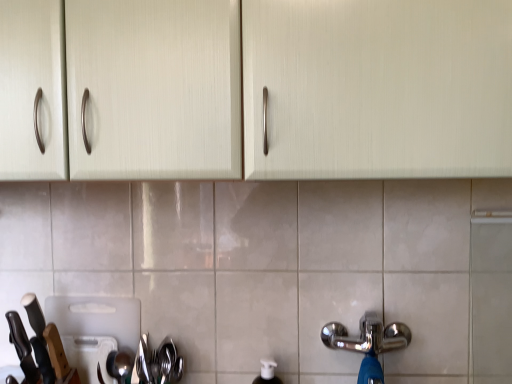
Image resolution: width=512 pixels, height=384 pixels. I want to click on shiny metallic spoon at lower left, so click(148, 363).

Measure the distance between point (136, 360) and camera.

Point (136, 360) is 1.02 meters from camera.

The image size is (512, 384). Identify the location of satin silver spoon at lower left, positioned as the second appliance in back-to-front order. (91, 356).

What do you see at coordinates (257, 89) in the screenshot? I see `matte cream cabinet at upper center` at bounding box center [257, 89].

Identify the location of shiny metallic spoon at lower left. [x=148, y=363].

In terms of width, does black leather knife at lower left, acting as the second knife starting from the right, look wider or thinner when compared to white plastic cutting board at lower left, acting as the first appliance starting from the back?

In the image, black leather knife at lower left, acting as the second knife starting from the right, appears to be wider than white plastic cutting board at lower left, acting as the first appliance starting from the back.

Is white plastic cutting board at lower left, the second appliance when ordered from front to back, surrounded by black leather knife at lower left, acting as the second knife starting from the right?

No.

Considering the sizes of objects black leather knife at lower left, arranged as the first knife when viewed from the left, and white plastic cutting board at lower left, the second appliance when ordered from front to back, in the image provided, who is taller, black leather knife at lower left, arranged as the first knife when viewed from the left, or white plastic cutting board at lower left, the second appliance when ordered from front to back,?

Standing taller between the two is white plastic cutting board at lower left, the second appliance when ordered from front to back.

From a real-world perspective, which object stands above the other?

shiny metallic spoon at lower left, from a real-world perspective.

Is shiny metallic spoon at lower left far from white plastic cutting board at lower left, acting as the first appliance starting from the back?

shiny metallic spoon at lower left is near white plastic cutting board at lower left, acting as the first appliance starting from the back, not far away.

Would you say shiny metallic spoon at lower left contains white plastic cutting board at lower left, acting as the first appliance starting from the back?

No, white plastic cutting board at lower left, acting as the first appliance starting from the back, is located outside of shiny metallic spoon at lower left.

How far apart are matte cream cabinet at upper center and black leather knife at lower left, arranged as the first knife when viewed from the left?

matte cream cabinet at upper center and black leather knife at lower left, arranged as the first knife when viewed from the left, are 67.93 centimeters apart.

Between point (298, 143) and point (21, 333), which one is positioned behind?

The point (21, 333) is more distant.

Are matte cream cabinet at upper center and black leather knife at lower left, arranged as the first knife when viewed from the left, beside each other?

matte cream cabinet at upper center is not next to black leather knife at lower left, arranged as the first knife when viewed from the left, and they're not touching.

Does point (138, 305) come closer to viewer compared to point (179, 365)?

No, (138, 305) is further to viewer.

Is white plastic cutting board at lower left, acting as the first appliance starting from the back, not within shiny metallic spoon at lower left?

Yes, white plastic cutting board at lower left, acting as the first appliance starting from the back, is not within shiny metallic spoon at lower left.

At what (x,y) coordinates should I click in order to perform the action: click on silverware on the right of white plastic cutting board at lower left, the second appliance when ordered from front to back. Please return your answer as a coordinate pair (x, y). The image size is (512, 384). Looking at the image, I should click on (148, 363).

Based on their sizes in the image, would you say white plastic cutting board at lower left, the second appliance when ordered from front to back, is bigger or smaller than black leather knife at lower left, arranged as the first knife when viewed from the left?

In the image, white plastic cutting board at lower left, the second appliance when ordered from front to back, appears to be larger than black leather knife at lower left, arranged as the first knife when viewed from the left.

Considering the relative positions of white plastic cutting board at lower left, the second appliance when ordered from front to back, and black leather knife at lower left, arranged as the first knife when viewed from the left, in the image provided, is white plastic cutting board at lower left, the second appliance when ordered from front to back, to the right of black leather knife at lower left, arranged as the first knife when viewed from the left, from the viewer's perspective?

Yes, white plastic cutting board at lower left, the second appliance when ordered from front to back, is to the right of black leather knife at lower left, arranged as the first knife when viewed from the left.

From the image's perspective, is white plastic cutting board at lower left, the second appliance when ordered from front to back, above black leather knife at lower left, arranged as the first knife when viewed from the left?

No, from the image's perspective, white plastic cutting board at lower left, the second appliance when ordered from front to back, is not on top of black leather knife at lower left, arranged as the first knife when viewed from the left.

Is black leather knife at lower left, arranged as the first knife when viewed from the left, surrounded by white plastic cutting board at lower left, the second appliance when ordered from front to back?

That's incorrect, black leather knife at lower left, arranged as the first knife when viewed from the left, is not inside white plastic cutting board at lower left, the second appliance when ordered from front to back.

From the picture: Is chrome metallic tap at lower right at the back of satin silver spoon at lower left, positioned as the first appliance in front-to-back order?

satin silver spoon at lower left, positioned as the first appliance in front-to-back order, does not have its back to chrome metallic tap at lower right.

Does satin silver spoon at lower left, positioned as the first appliance in front-to-back order, have a lesser width compared to chrome metallic tap at lower right?

Indeed, satin silver spoon at lower left, positioned as the first appliance in front-to-back order, has a lesser width compared to chrome metallic tap at lower right.

Is satin silver spoon at lower left, positioned as the second appliance in back-to-front order, closer to the viewer compared to chrome metallic tap at lower right?

No.

From a real-world perspective, is satin silver spoon at lower left, positioned as the first appliance in front-to-back order, above or below chrome metallic tap at lower right?

From a real-world perspective, satin silver spoon at lower left, positioned as the first appliance in front-to-back order, is physically below chrome metallic tap at lower right.

I want to click on cabinetry that is on the right side of white plastic cutting board at lower left, acting as the first appliance starting from the back, so pos(257,89).

Is white plastic cutting board at lower left, acting as the first appliance starting from the back, thinner than matte cream cabinet at upper center?

Yes.

From the image's perspective, which object appears higher, white plastic cutting board at lower left, the second appliance when ordered from front to back, or matte cream cabinet at upper center?

matte cream cabinet at upper center appears higher in the image.

Which is less distant, (100, 321) or (88, 170)?

Point (100, 321) appears to be farther away from the viewer than point (88, 170).

Locate an element on the screen. The image size is (512, 384). the 2nd knife to the left of the white plastic cutting board at lower left, acting as the first appliance starting from the back, counting from the anchor's position is located at coordinates (22, 347).

Locate an element on the screen. The width and height of the screenshot is (512, 384). silverware in front of the white plastic cutting board at lower left, acting as the first appliance starting from the back is located at coordinates (148, 363).

Based on their spatial positions, is matte cream cabinet at upper center or white plastic cutting board at lower left, the second appliance when ordered from front to back, closer to chrome metallic tap at lower right?

white plastic cutting board at lower left, the second appliance when ordered from front to back, is closer to chrome metallic tap at lower right.

Which object lies nearer to the anchor point black leather knife at lower left, arranged as the first knife when viewed from the left, black matte knife at left, positioned as the 2th knife in left-to-right order, or satin silver spoon at lower left, positioned as the second appliance in back-to-front order?

Based on the image, black matte knife at left, positioned as the 2th knife in left-to-right order, appears to be nearer to black leather knife at lower left, arranged as the first knife when viewed from the left.

Based on their spatial positions, is matte cream cabinet at upper center or white plastic cutting board at lower left, the second appliance when ordered from front to back, closer to black matte knife at left, positioned as the 2th knife in left-to-right order?

Based on the image, white plastic cutting board at lower left, the second appliance when ordered from front to back, appears to be nearer to black matte knife at left, positioned as the 2th knife in left-to-right order.

Looking at the image, which one is located closer to black matte knife at left, the 1th knife from the right, black leather knife at lower left, arranged as the first knife when viewed from the left, or satin silver spoon at lower left, positioned as the first appliance in front-to-back order?

The object closer to black matte knife at left, the 1th knife from the right, is black leather knife at lower left, arranged as the first knife when viewed from the left.

When comparing their distances from satin silver spoon at lower left, positioned as the second appliance in back-to-front order, does chrome metallic tap at lower right or black matte knife at left, the 1th knife from the right, seem closer?

black matte knife at left, the 1th knife from the right, lies closer to satin silver spoon at lower left, positioned as the second appliance in back-to-front order, than the other object.

Looking at the image, which one is located further to white plastic cutting board at lower left, acting as the first appliance starting from the back, satin silver spoon at lower left, positioned as the first appliance in front-to-back order, or matte cream cabinet at upper center?

The object further to white plastic cutting board at lower left, acting as the first appliance starting from the back, is matte cream cabinet at upper center.

Looking at the image, which one is located closer to satin silver spoon at lower left, positioned as the second appliance in back-to-front order, black matte knife at left, the 1th knife from the right, or shiny metallic spoon at lower left?

shiny metallic spoon at lower left is closer to satin silver spoon at lower left, positioned as the second appliance in back-to-front order.

Based on their spatial positions, is black leather knife at lower left, arranged as the first knife when viewed from the left, or white plastic cutting board at lower left, acting as the first appliance starting from the back, closer to matte cream cabinet at upper center?

white plastic cutting board at lower left, acting as the first appliance starting from the back.

Where is `appliance that lies between matte cream cabinet at upper center and satin silver spoon at lower left, positioned as the second appliance in back-to-front order, from top to bottom`? appliance that lies between matte cream cabinet at upper center and satin silver spoon at lower left, positioned as the second appliance in back-to-front order, from top to bottom is located at coordinates (95, 330).

I want to click on silverware between satin silver spoon at lower left, positioned as the first appliance in front-to-back order, and chrome metallic tap at lower right from left to right, so click(x=148, y=363).

Identify the location of appliance between satin silver spoon at lower left, positioned as the first appliance in front-to-back order, and shiny metallic spoon at lower left. This screenshot has width=512, height=384. (95, 330).

This screenshot has width=512, height=384. What are the coordinates of `silverware located between black matte knife at left, positioned as the 2th knife in left-to-right order, and chrome metallic tap at lower right in the left-right direction` in the screenshot? It's located at (148, 363).